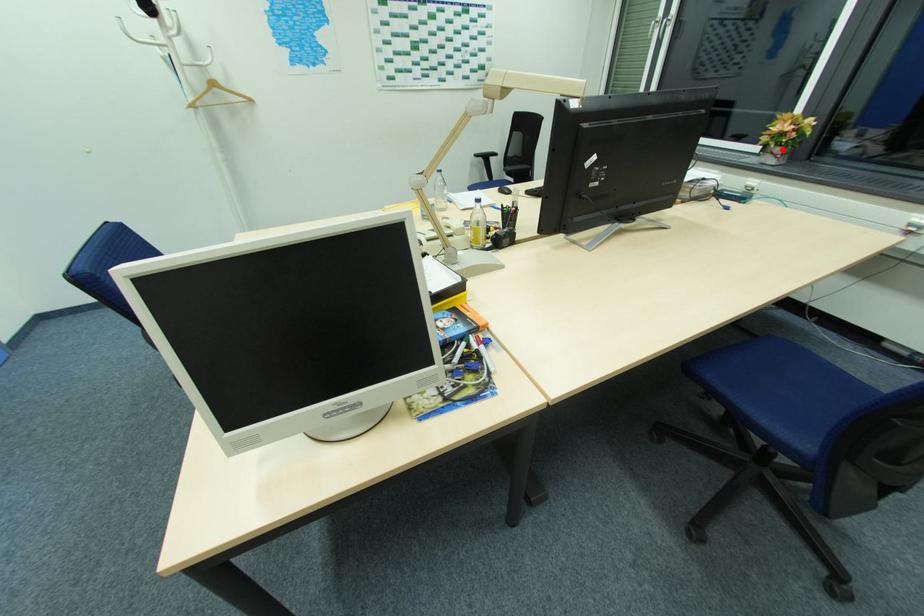
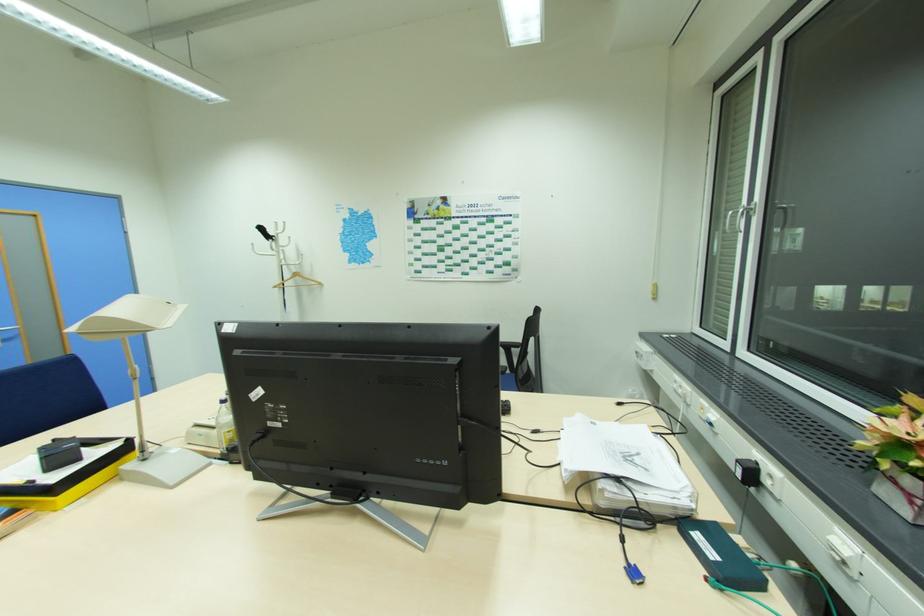
Locate, in the second image, the point that corresponds to the highlighted location in the first image.

(912, 484)